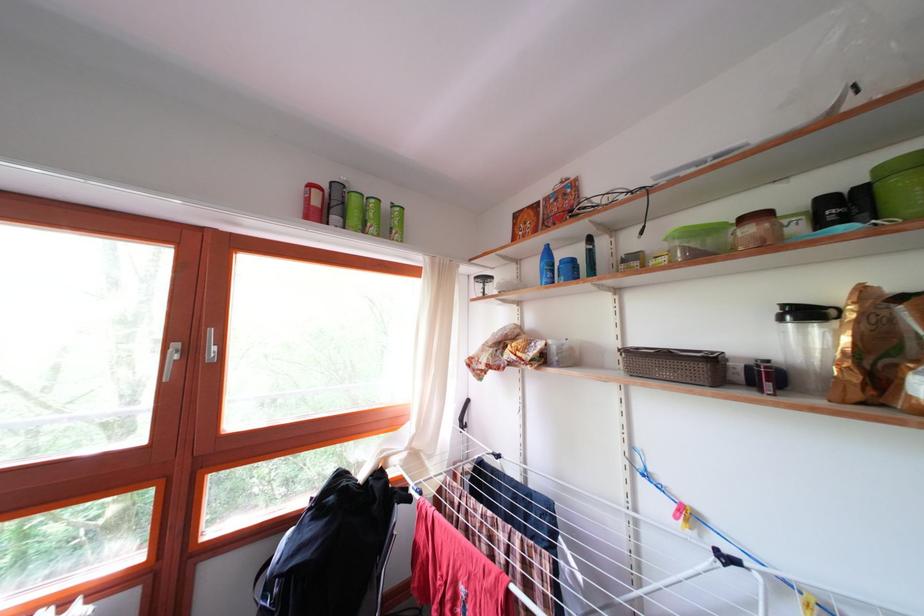
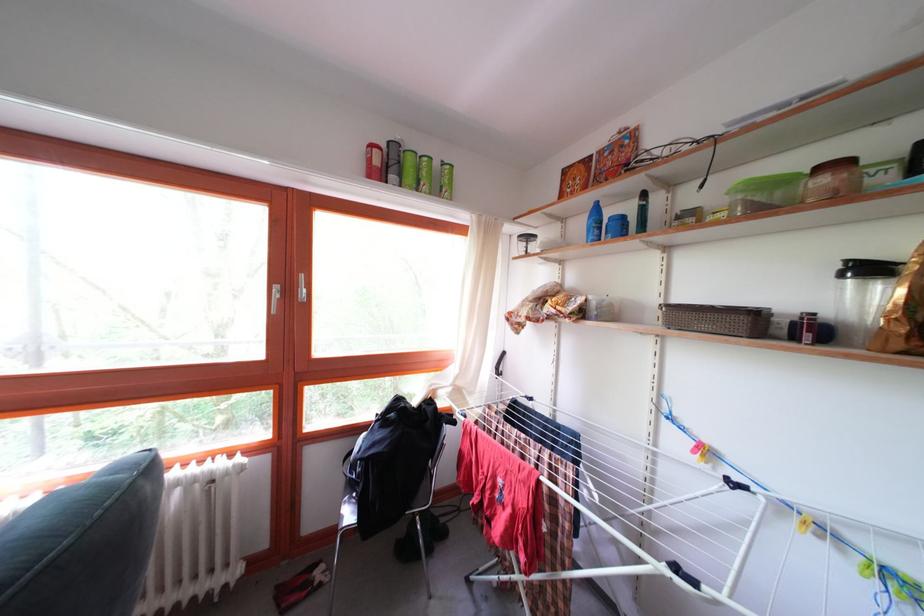
Find the pixel in the second image that matches pixel 791 312 in the first image.

(855, 267)